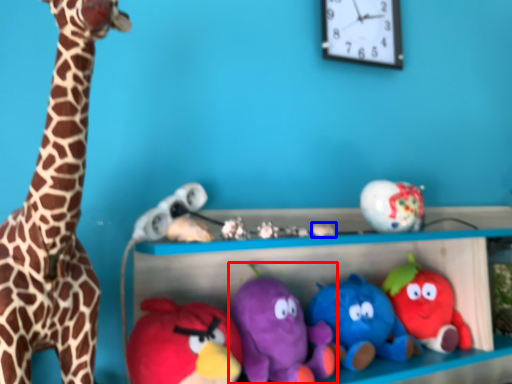
Question: Which object appears closest to the camera in this image, toy (highlighted by a red box) or toy (highlighted by a blue box)?

Choices:
 (A) toy
 (B) toy

Answer: (A)